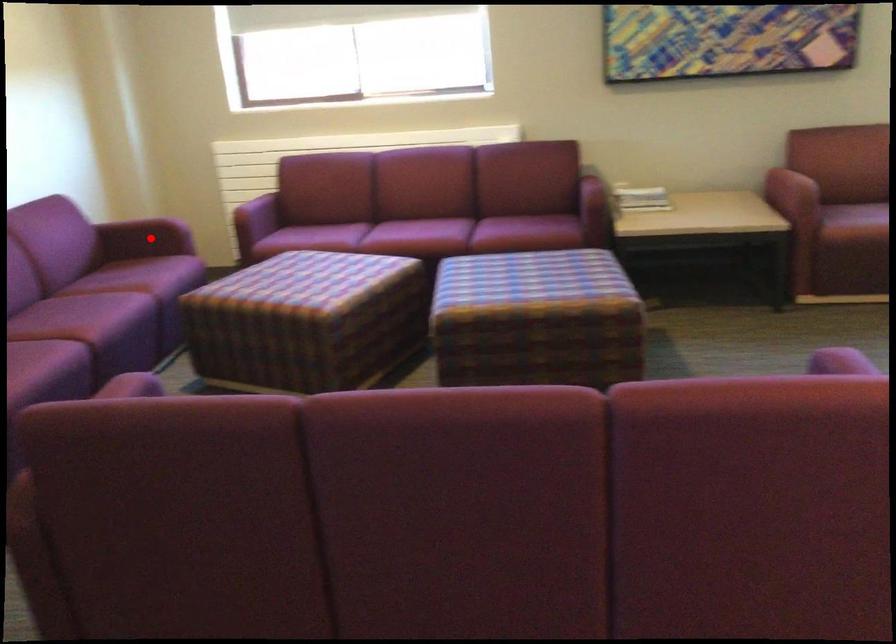
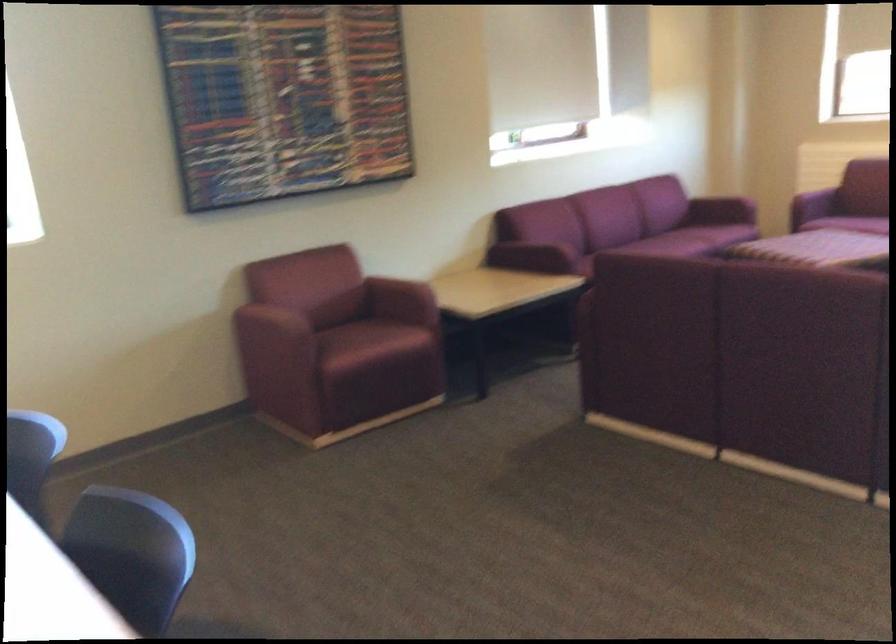
Locate, in the second image, the point that corresponds to the highlighted location in the first image.

(720, 211)